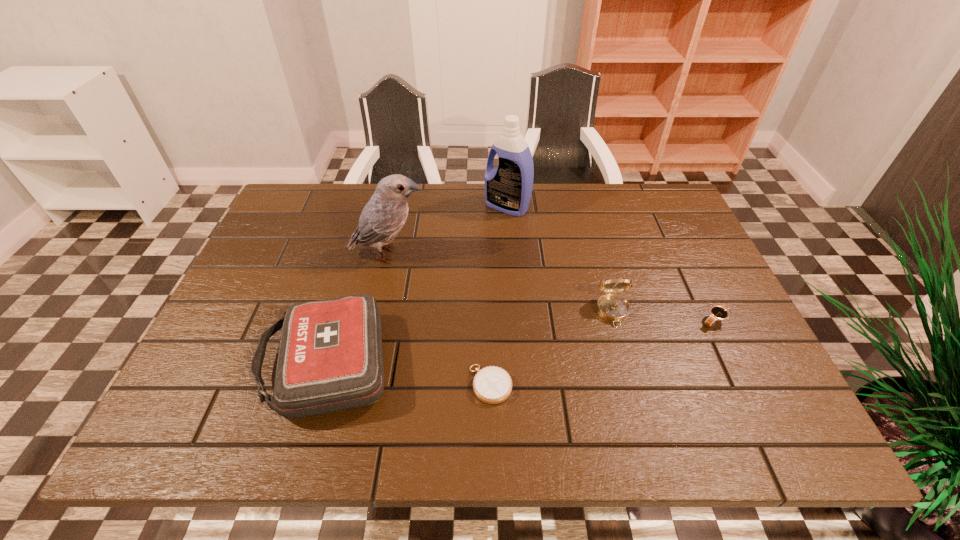
Identify the location of the farthest object. This screenshot has height=540, width=960. (508, 188).

The image size is (960, 540). In order to click on parrot in this screenshot , I will do `click(384, 215)`.

I want to click on the fifth nearest object, so (384, 215).

Where is `the second object from right to left`? This screenshot has height=540, width=960. the second object from right to left is located at coordinates (612, 307).

Where is `the farther compass`? The height and width of the screenshot is (540, 960). the farther compass is located at coordinates (612, 307).

The image size is (960, 540). Identify the location of the first-aid kit. click(330, 358).

Find the location of a particular element. the rightmost object is located at coordinates (717, 313).

Find the location of a particular element. This screenshot has width=960, height=540. watch is located at coordinates (717, 313).

The width and height of the screenshot is (960, 540). Identify the location of the shortest object. (492, 384).

Where is `the left compass`? The image size is (960, 540). the left compass is located at coordinates (492, 384).